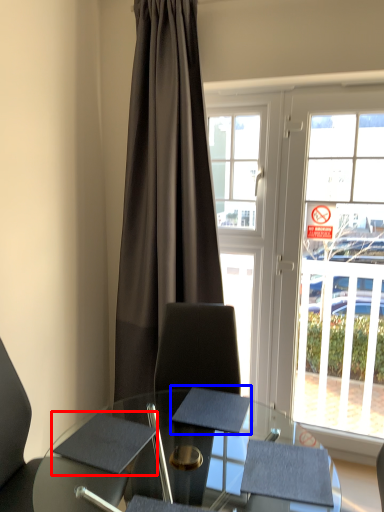
Question: Which point is closer to the camera, notepad (highlighted by a red box) or notepad (highlighted by a blue box)?

Choices:
 (A) notepad
 (B) notepad

Answer: (A)